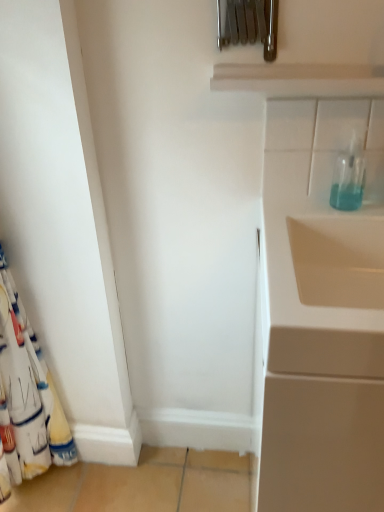
Question: From the image's perspective, is transparent glass bottle at upper right positioned above or below white fabric curtain at left?

Choices:
 (A) above
 (B) below

Answer: (A)

Question: From a real-world perspective, is transparent glass bottle at upper right positioned above or below white fabric curtain at left?

Choices:
 (A) above
 (B) below

Answer: (A)

Question: Which is nearer to the white glossy cabinet at right?

Choices:
 (A) transparent glass bottle at upper right
 (B) white fabric curtain at left

Answer: (A)

Question: Which object is positioned farthest from the white fabric curtain at left?

Choices:
 (A) transparent glass bottle at upper right
 (B) white glossy cabinet at right

Answer: (A)